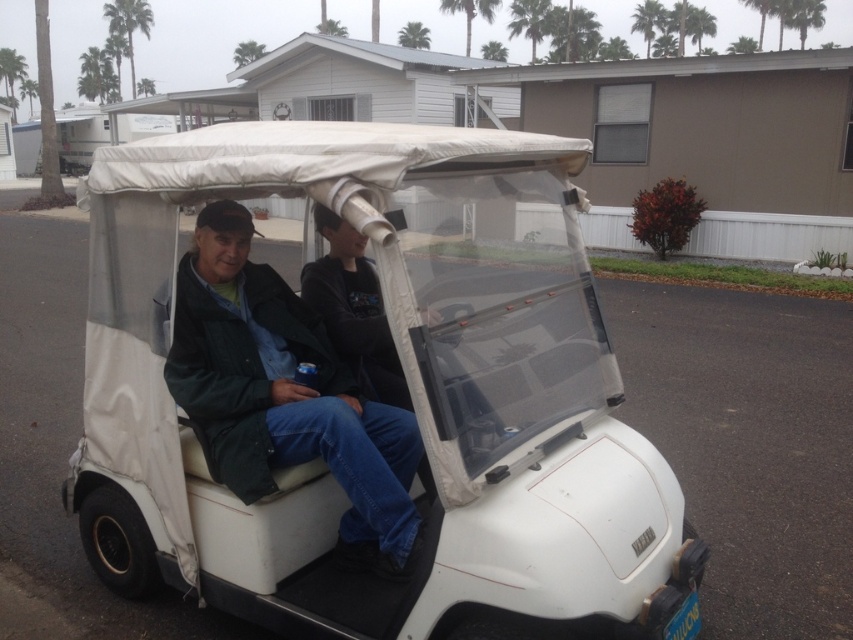
Question: Can you confirm if dark green jacket at center is thinner than green leafy palm tree at upper left?

Choices:
 (A) no
 (B) yes

Answer: (B)

Question: Which point is farther from the camera taking this photo?

Choices:
 (A) (115, 29)
 (B) (317, 400)
 (C) (386, 454)

Answer: (A)

Question: Estimate the real-world distances between objects in this image. Which object is closer to the white matte golf cart at center?

Choices:
 (A) dark green jacket at center
 (B) dark gray fabric jacket at center
 (C) green leafy palm tree at upper left

Answer: (A)

Question: Does dark green jacket at center lie behind dark gray fabric jacket at center?

Choices:
 (A) yes
 (B) no

Answer: (B)

Question: Where is dark gray fabric jacket at center located in relation to green leafy palm tree at upper left in the image?

Choices:
 (A) below
 (B) above

Answer: (A)

Question: Which point is farther to the camera?

Choices:
 (A) (262, 426)
 (B) (109, 26)
 (C) (113, 515)
 (D) (338, 300)

Answer: (B)